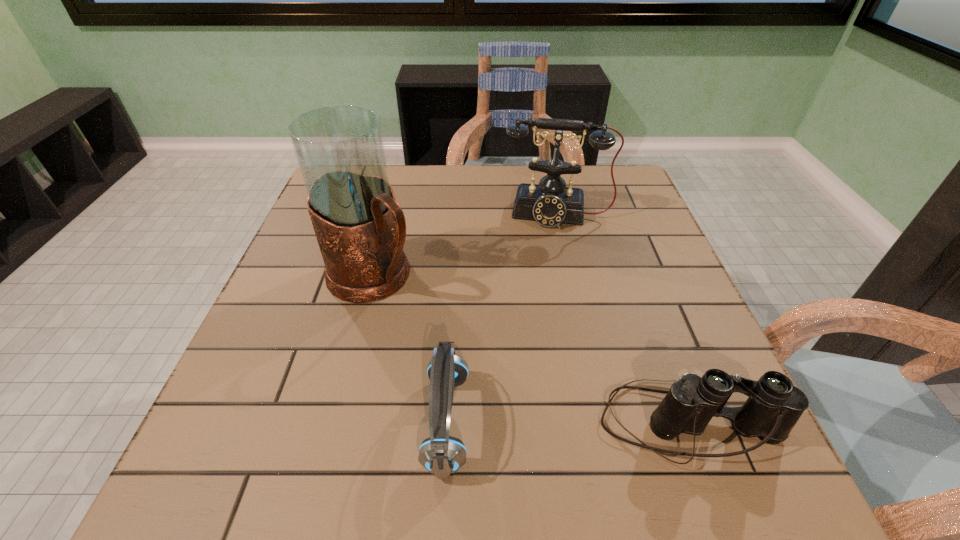
The width and height of the screenshot is (960, 540). In order to click on vacant region located with the handle on the side of the leftmost object in this screenshot , I will do `click(478, 356)`.

Identify the location of vacant space located on the dial of the telephone. (545, 286).

You are a GUI agent. You are given a task and a screenshot of the screen. Output one action in this format:
    pyautogui.click(x=<x>, y=<y>)
    Task: Click on the free space located on the dial of the telephone
    Image resolution: width=960 pixels, height=540 pixels.
    Given the screenshot: What is the action you would take?
    pyautogui.click(x=544, y=295)

I want to click on free space located 0.290m on the dial of the telephone, so click(x=543, y=312).

This screenshot has width=960, height=540. Find the location of `object present at the far edge`. object present at the far edge is located at coordinates pos(551,203).

Locate an element on the screen. The image size is (960, 540). headset located at the near edge is located at coordinates (441, 454).

You are a GUI agent. You are given a task and a screenshot of the screen. Output one action in this format:
    pyautogui.click(x=<x>, y=<y>)
    Task: Click on the binoculars that is positioned at the near edge
    The image size is (960, 540).
    Given the screenshot: What is the action you would take?
    pyautogui.click(x=774, y=406)

The height and width of the screenshot is (540, 960). I want to click on object that is at the left edge, so click(x=360, y=228).

Locate an element on the screen. Image resolution: width=960 pixels, height=540 pixels. binoculars that is positioned at the right edge is located at coordinates (774, 406).

The width and height of the screenshot is (960, 540). I want to click on telephone present at the right edge, so click(x=551, y=203).